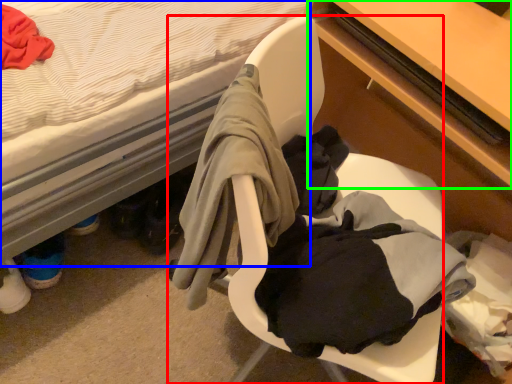
Question: Estimate the real-world distances between objects in this image. Which object is farther from chair (highlighted by a red box), bed (highlighted by a blue box) or table (highlighted by a green box)?

Choices:
 (A) bed
 (B) table

Answer: (A)